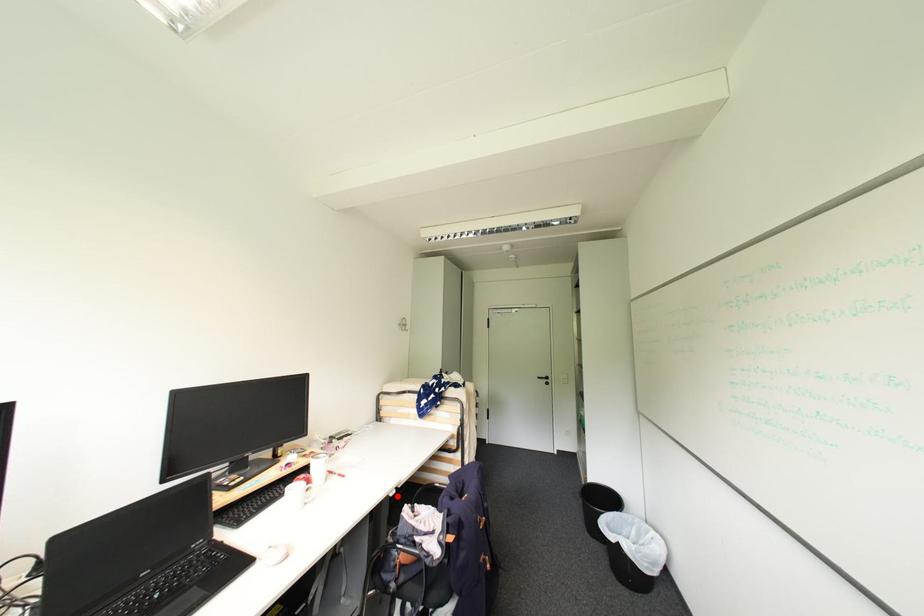
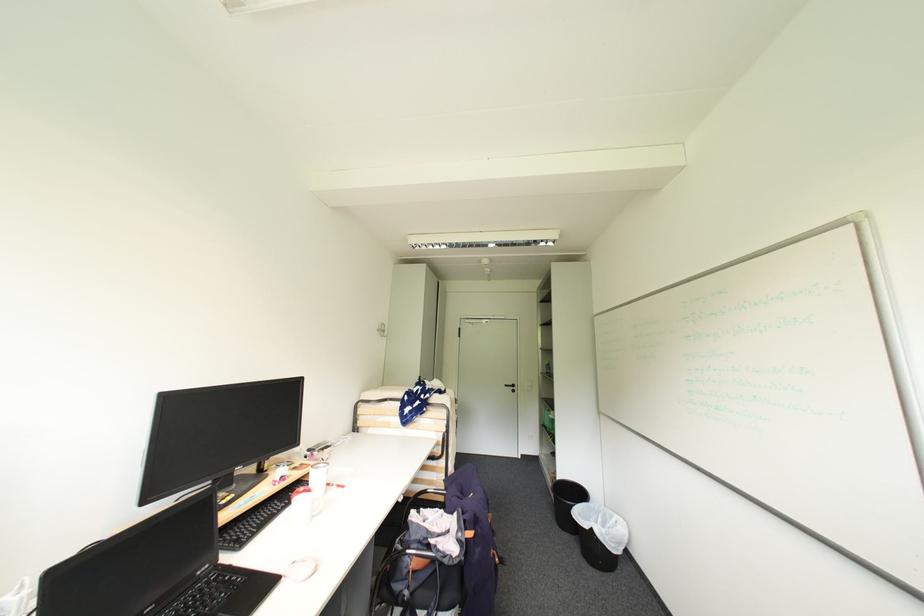
Locate, in the second image, the point that corresponds to the highlighted location in the first image.

(407, 501)